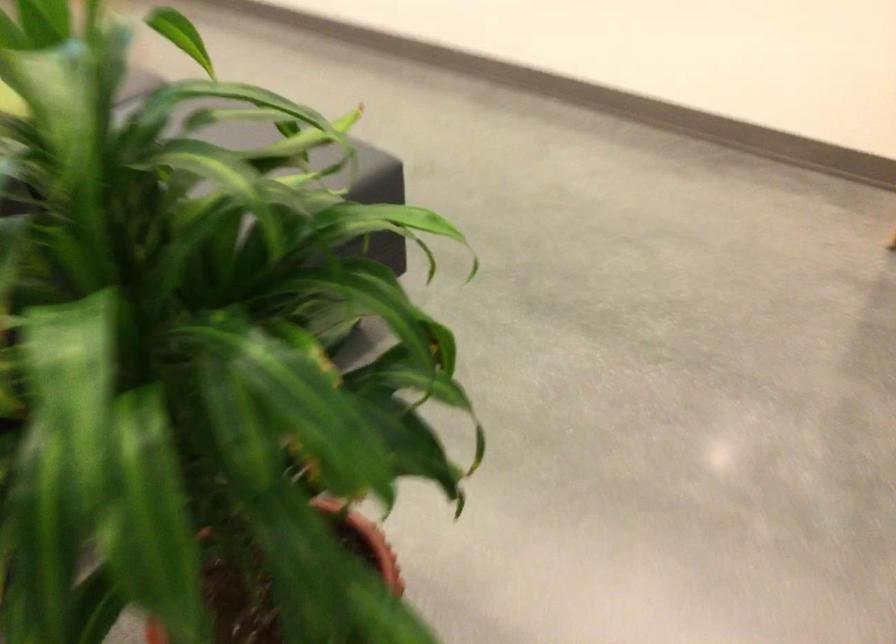
At what (x,y) coordinates should I click in order to perform the action: click on sofa sitting surface. Please return your answer as a coordinate pair (x, y). This screenshot has height=644, width=896. Looking at the image, I should click on (367, 167).